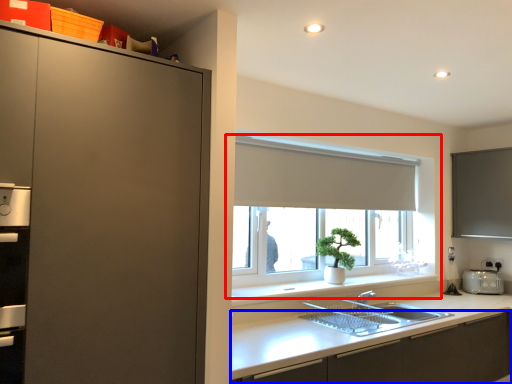
Question: Which point is further to the camera, window (highlighted by a red box) or cabinetry (highlighted by a blue box)?

Choices:
 (A) window
 (B) cabinetry

Answer: (A)